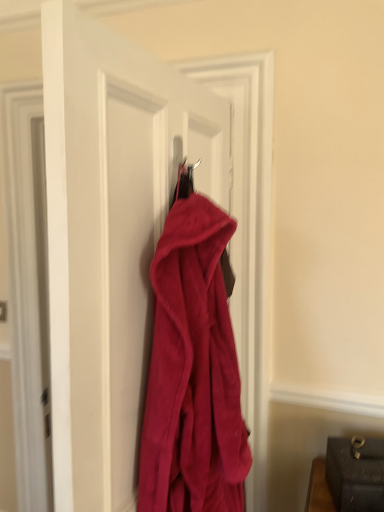
What do you see at coordinates (193, 368) in the screenshot? I see `fuzzy red coat at center` at bounding box center [193, 368].

You are a GUI agent. You are given a task and a screenshot of the screen. Output one action in this format:
    pyautogui.click(x=<x>, y=<y>)
    Task: Click on the fuzzy red coat at center
    Image resolution: width=384 pixels, height=512 pixels.
    Given the screenshot: What is the action you would take?
    [x=193, y=368]

From the picture: What is the approximate height of velvet red coat at center?

3.95 feet.

Image resolution: width=384 pixels, height=512 pixels. What do you see at coordinates (111, 237) in the screenshot?
I see `velvet red coat at center` at bounding box center [111, 237].

Find the location of a particular element. This screenshot has width=384, height=512. velvet red coat at center is located at coordinates (111, 237).

The height and width of the screenshot is (512, 384). I want to click on fuzzy red coat at center, so click(193, 368).

Would you say velvet red coat at center is to the left or to the right of fuzzy red coat at center in the picture?

In the image, velvet red coat at center appears on the left side of fuzzy red coat at center.

Which object is more forward, velvet red coat at center or fuzzy red coat at center?

velvet red coat at center is more forward.

Considering the points (86, 224) and (201, 328), which point is behind, point (86, 224) or point (201, 328)?

The point (201, 328) is behind.

From the image's perspective, who appears lower, velvet red coat at center or fuzzy red coat at center?

fuzzy red coat at center.

From a real-world perspective, does velvet red coat at center stand above fuzzy red coat at center?

Correct, in the physical world, velvet red coat at center is higher than fuzzy red coat at center.

In terms of width, does velvet red coat at center look wider or thinner when compared to fuzzy red coat at center?

In the image, velvet red coat at center appears to be more narrow than fuzzy red coat at center.

Which of these two, velvet red coat at center or fuzzy red coat at center, stands shorter?

Standing shorter between the two is fuzzy red coat at center.

Can you confirm if velvet red coat at center is smaller than fuzzy red coat at center?

Actually, velvet red coat at center might be larger than fuzzy red coat at center.

Choose the correct answer: Is velvet red coat at center inside fuzzy red coat at center or outside it?

velvet red coat at center lies outside fuzzy red coat at center.

Is velvet red coat at center far away from fuzzy red coat at center?

No, there isn't a large distance between velvet red coat at center and fuzzy red coat at center.

Is velvet red coat at center turned away from fuzzy red coat at center?

Yes, velvet red coat at center is positioned with its back facing fuzzy red coat at center.

Can you tell me how much velvet red coat at center and fuzzy red coat at center differ in facing direction?

The angular difference between velvet red coat at center and fuzzy red coat at center is 0.00161 degrees.

How much distance is there between velvet red coat at center and fuzzy red coat at center?

velvet red coat at center and fuzzy red coat at center are 5.74 inches apart from each other.

Identify the location of towel below the velvet red coat at center (from the image's perspective). The image size is (384, 512). (193, 368).

Between fuzzy red coat at center and velvet red coat at center, which one appears on the right side from the viewer's perspective?

fuzzy red coat at center is more to the right.

Does fuzzy red coat at center lie in front of velvet red coat at center?

No, fuzzy red coat at center is behind velvet red coat at center.

Is point (217, 339) in front of point (104, 459)?

No.

Consider the image. From the image's perspective, relative to velvet red coat at center, is fuzzy red coat at center above or below?

fuzzy red coat at center is below velvet red coat at center.

From a real-world perspective, who is located higher, fuzzy red coat at center or velvet red coat at center?

velvet red coat at center is physically above.

Considering the relative sizes of fuzzy red coat at center and velvet red coat at center in the image provided, is fuzzy red coat at center wider than velvet red coat at center?

Indeed, fuzzy red coat at center has a greater width compared to velvet red coat at center.

Is fuzzy red coat at center taller or shorter than velvet red coat at center?

fuzzy red coat at center is shorter than velvet red coat at center.

Between fuzzy red coat at center and velvet red coat at center, which one has larger size?

With larger size is velvet red coat at center.

Is fuzzy red coat at center situated inside velvet red coat at center or outside?

fuzzy red coat at center lies within the bounds of velvet red coat at center.

Is fuzzy red coat at center with velvet red coat at center?

There is a gap between fuzzy red coat at center and velvet red coat at center.

Is fuzzy red coat at center turned away from velvet red coat at center?

No, velvet red coat at center is not at the back of fuzzy red coat at center.

Can you tell me how much fuzzy red coat at center and velvet red coat at center differ in facing direction?

fuzzy red coat at center and velvet red coat at center are facing 0.00161 degrees away from each other.

Find the location of a particular element. This screenshot has width=384, height=512. door above the fuzzy red coat at center (from the image's perspective) is located at coordinates (111, 237).

The width and height of the screenshot is (384, 512). I want to click on door on the left of the fuzzy red coat at center, so click(x=111, y=237).

You are a GUI agent. You are given a task and a screenshot of the screen. Output one action in this format:
    pyautogui.click(x=<x>, y=<y>)
    Task: Click on the door above the fuzzy red coat at center (from a real-world perspective)
    This screenshot has height=512, width=384.
    Given the screenshot: What is the action you would take?
    pyautogui.click(x=111, y=237)